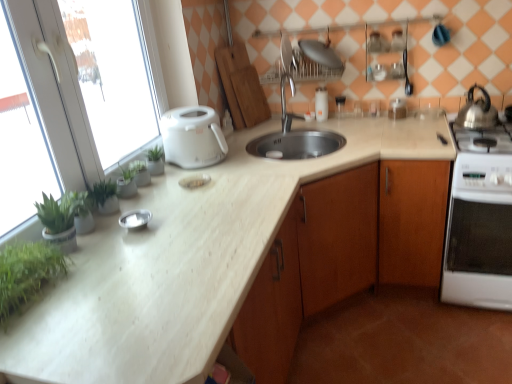
Where is `vacant space that is to the left of clear glass jar at upper right, which is the second appliance from back to front`? vacant space that is to the left of clear glass jar at upper right, which is the second appliance from back to front is located at coordinates (371, 117).